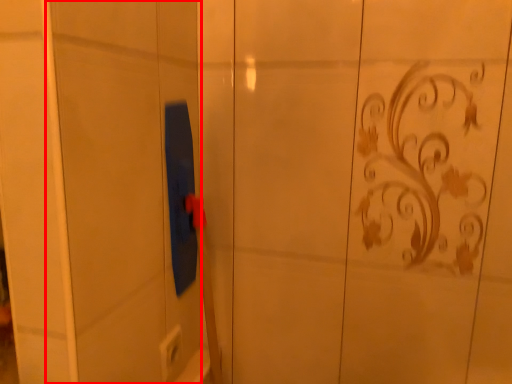
Question: From the image, what is the correct spatial relationship of screen door (annotated by the red box) in relation to electric outlet?

Choices:
 (A) right
 (B) left

Answer: (B)